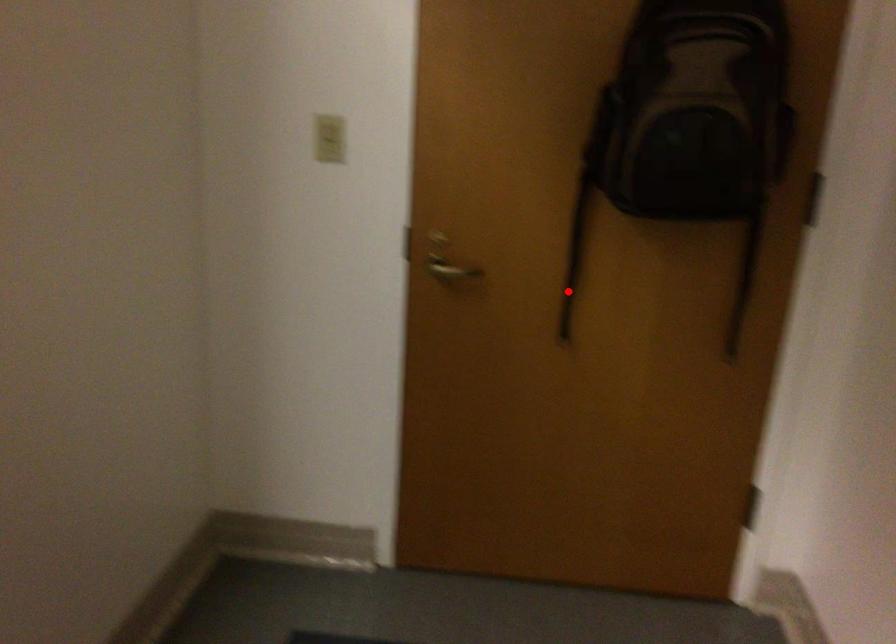
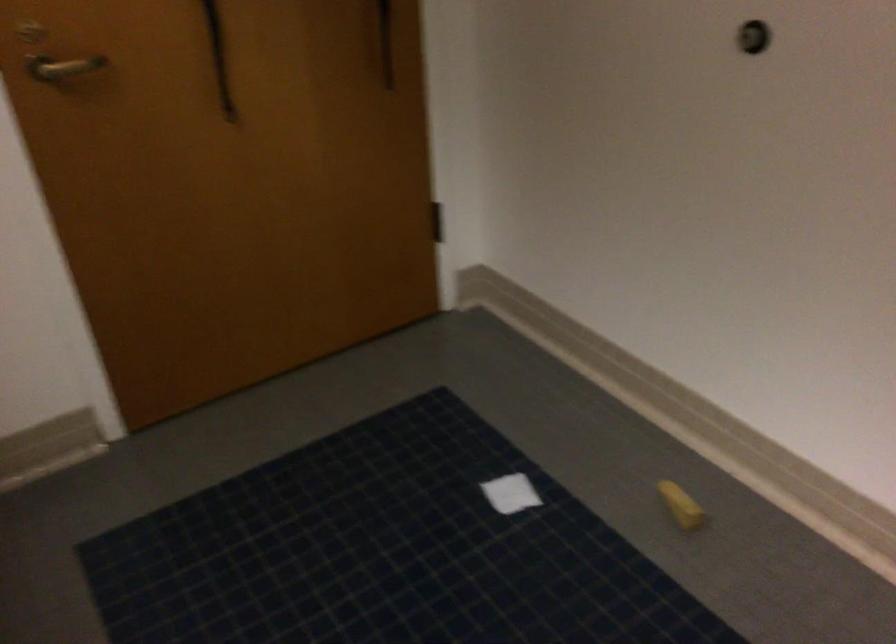
Question: I am providing you with two images of the same scene from different viewpoints. Image1 has a red point marked. In image2, the corresponding 3D location appears at what relative position? Reply with the corresponding letter.

Choices:
 (A) Closer
 (B) Farther

Answer: (A)